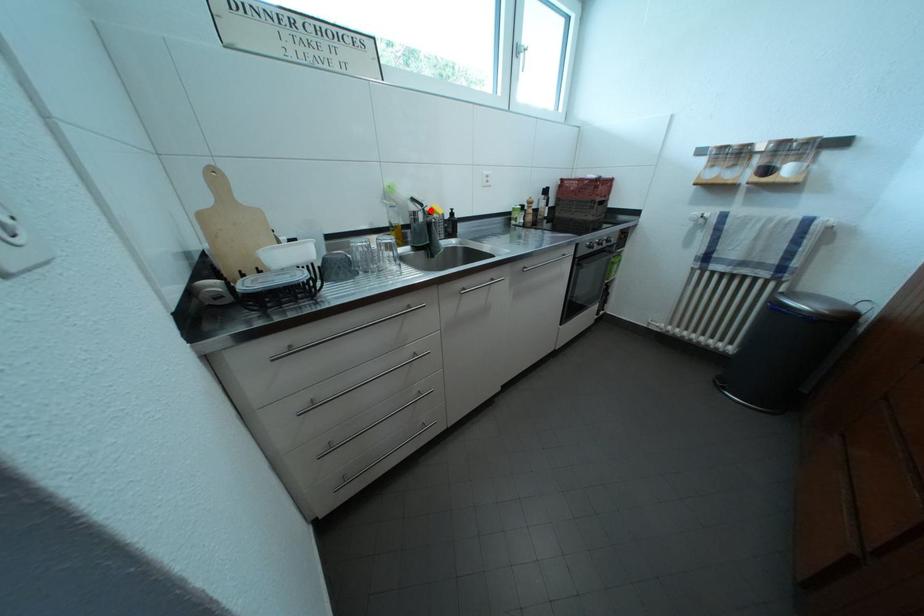
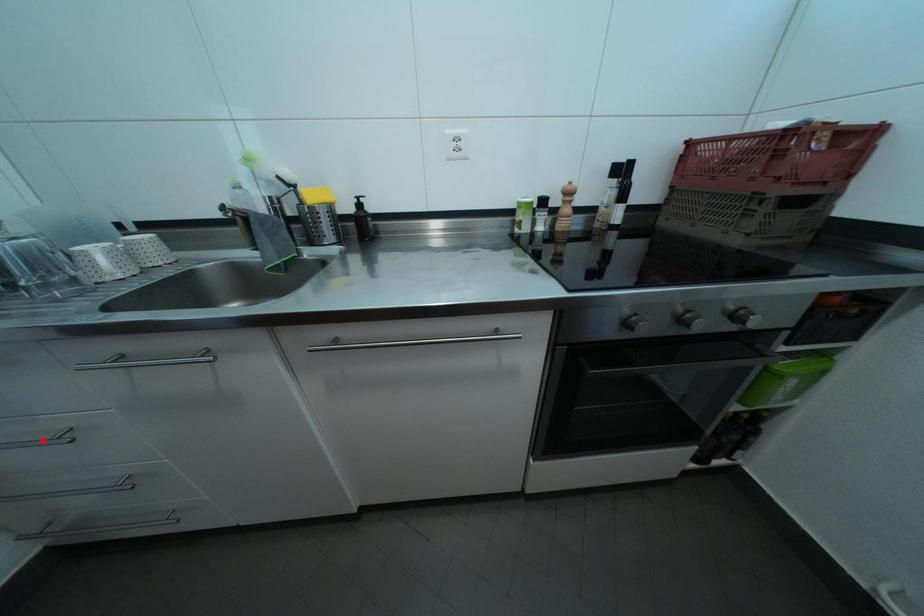
I am providing you with two images of the same scene from different viewpoints. A red point is marked on the first image and another point is marked on the second image. Does the point marked in image1 correspond to the same location as the one in image2?

No